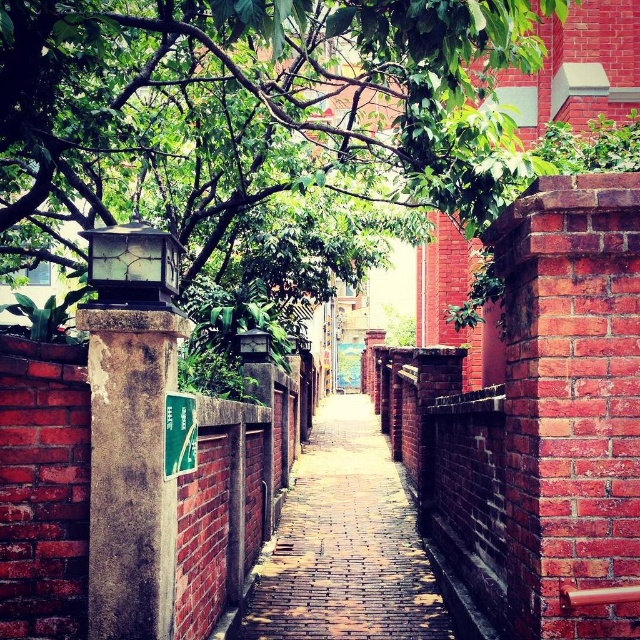
Question: Is green leafy tree at upper left positioned behind brick paved walkway at center?

Choices:
 (A) no
 (B) yes

Answer: (B)

Question: Is green leafy tree at upper left below brick paved walkway at center?

Choices:
 (A) no
 (B) yes

Answer: (A)

Question: Is green leafy tree at upper left to the right of brick paved walkway at center from the viewer's perspective?

Choices:
 (A) no
 (B) yes

Answer: (A)

Question: Which point is farther from the camera taking this photo?

Choices:
 (A) (26, 214)
 (B) (301, 508)

Answer: (B)